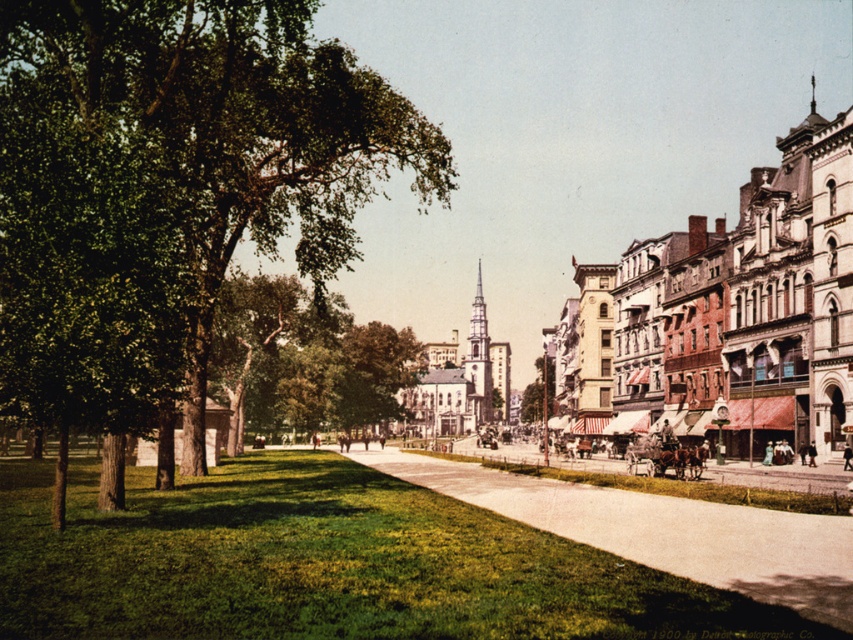
Is green leafy tree at left thinner than smooth concrete sidewalk at center?

Incorrect, green leafy tree at left's width is not less than smooth concrete sidewalk at center's.

Between point (137, 404) and point (838, 616), which one is positioned in front?

Point (838, 616) is more forward.

Identify the location of green leafy tree at left. (x=170, y=189).